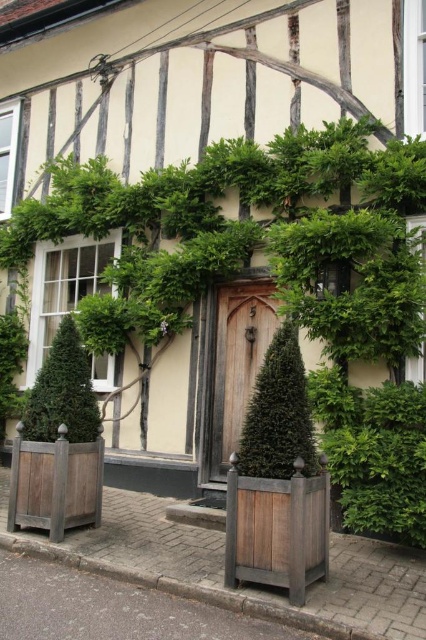
You are standing in front of the half timbered building and want to know which of the two points, point (x=285, y=406) or point (x=244, y=406), is closer to you. Which one is closer?

Point (x=285, y=406) is closer to the camera than point (x=244, y=406).

You are standing in front of the half timbered building and want to enter through the wooden door at center. However, there is a green coniferous tree at left blocking your path. Can you walk straight to the door without going around the tree?

The wooden door at center is below the green coniferous tree at left, meaning the tree is positioned above the door. Since the tree is above the door, it does not block the path to the door, so you can walk straight to the wooden door at center without needing to go around the tree.

You are a delivery person standing at the entrance of the half timbered building. You need to place a package that is 3 feet wide between the green textured cone at center and the wooden door at center. Is there enough space to place the package without moving either object?

The distance between the green textured cone at center and the wooden door at center is 7.82 feet. Since the package is 3 feet wide, there is sufficient space to place it between them without needing to move either object.